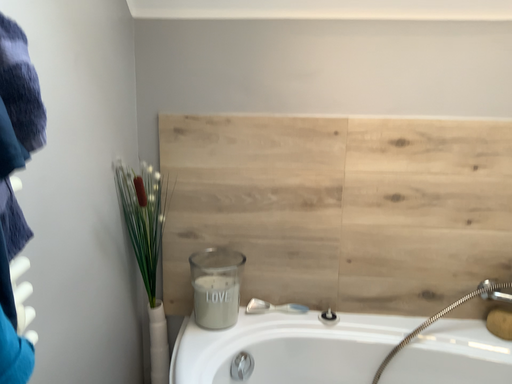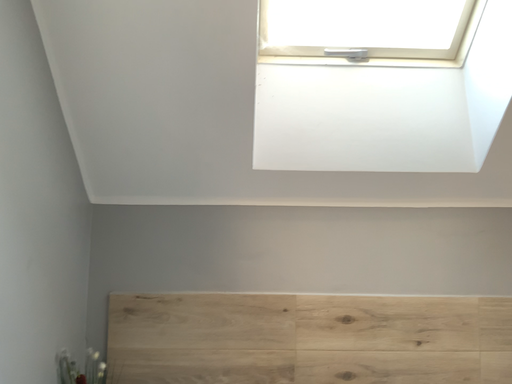
Question: How did the camera likely rotate when shooting the video?

Choices:
 (A) rotated upward
 (B) rotated downward

Answer: (A)